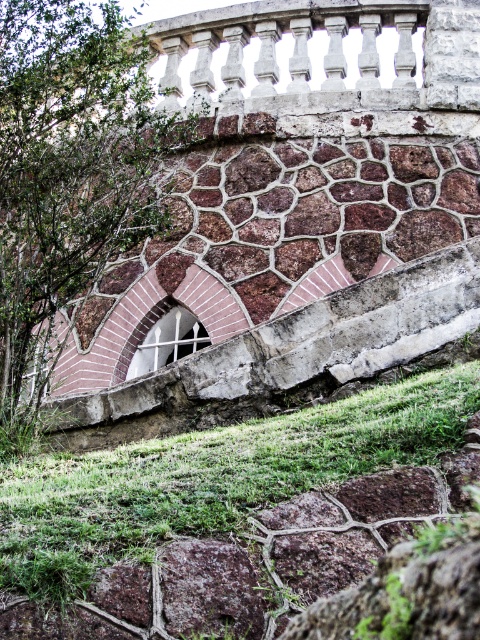
Question: Which is farther from the white glass window at center?

Choices:
 (A) green grass at lower center
 (B) green leafy tree at upper left

Answer: (A)

Question: Does green leafy tree at upper left have a larger size compared to green grass at lower center?

Choices:
 (A) yes
 (B) no

Answer: (A)

Question: Does green leafy tree at upper left appear on the left side of green grass at lower center?

Choices:
 (A) yes
 (B) no

Answer: (A)

Question: Among these points, which one is nearest to the camera?

Choices:
 (A) 60,508
 (B) 145,339
 (C) 67,179

Answer: (A)

Question: Which point appears farthest from the camera in this image?

Choices:
 (A) (193, 320)
 (B) (46, 573)
 (C) (124, 49)

Answer: (A)

Question: Is green leafy tree at upper left to the right of green grass at lower center from the viewer's perspective?

Choices:
 (A) no
 (B) yes

Answer: (A)